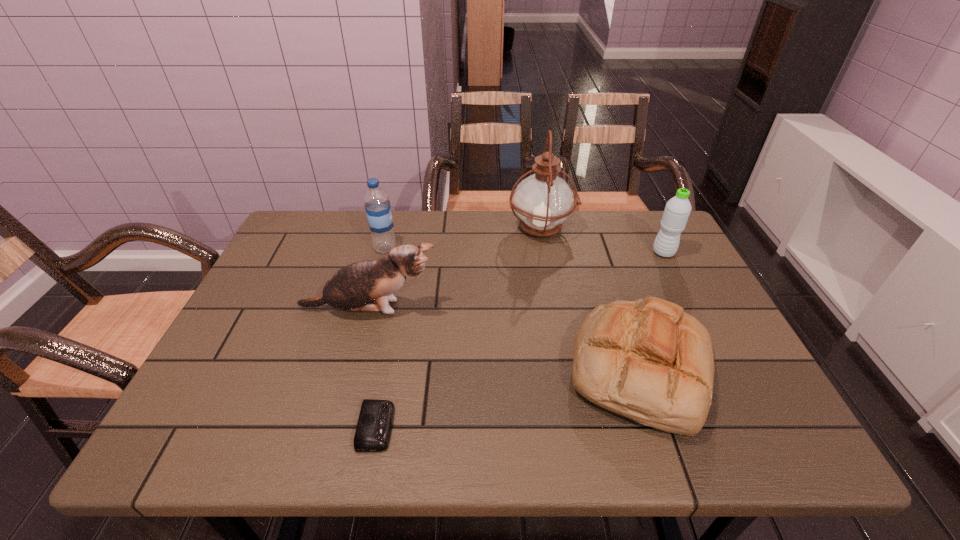
Where is `free region located 0.110m on the back of the fifth tallest object`? The width and height of the screenshot is (960, 540). free region located 0.110m on the back of the fifth tallest object is located at coordinates (612, 284).

You are a GUI agent. You are given a task and a screenshot of the screen. Output one action in this format:
    pyautogui.click(x=<x>, y=<y>)
    Task: Click on the vacant area located 0.390m on the display of the alarm clock
    
    Given the screenshot: What is the action you would take?
    (x=591, y=427)

You are a GUI agent. You are given a task and a screenshot of the screen. Output one action in this format:
    pyautogui.click(x=<x>, y=<y>)
    Task: Click on the oil lamp that is at the far edge
    Image resolution: width=960 pixels, height=540 pixels.
    Given the screenshot: What is the action you would take?
    pyautogui.click(x=543, y=201)

The height and width of the screenshot is (540, 960). Find the location of `bread that is positioned at the near edge`. bread that is positioned at the near edge is located at coordinates (647, 360).

This screenshot has height=540, width=960. What are the coordinates of `alarm clock that is at the near edge` in the screenshot? It's located at (374, 426).

Find the location of a particular element. object at the left edge is located at coordinates (352, 288).

This screenshot has width=960, height=540. What are the coordinates of `water bottle situated at the right edge` in the screenshot? It's located at (677, 210).

Identify the location of bread that is positioned at the right edge. (647, 360).

Find the location of a particular element. The height and width of the screenshot is (540, 960). object at the far right corner is located at coordinates (677, 210).

You are a GUI agent. You are given a task and a screenshot of the screen. Output one action in this format:
    pyautogui.click(x=<x>, y=<y>)
    Task: Click on the object that is at the near right corner
    This screenshot has height=540, width=960.
    Given the screenshot: What is the action you would take?
    pyautogui.click(x=647, y=360)